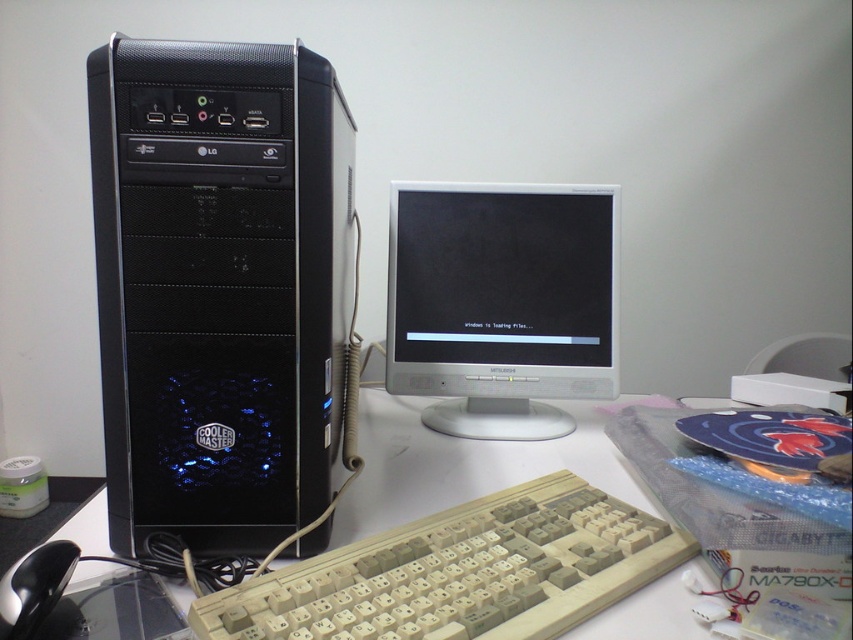
Is white plastic keyboard at center to the left of beige plastic keyboard at lower center from the viewer's perspective?

No, white plastic keyboard at center is not to the left of beige plastic keyboard at lower center.

Is white plastic keyboard at center taller than beige plastic keyboard at lower center?

Correct, white plastic keyboard at center is much taller as beige plastic keyboard at lower center.

The height and width of the screenshot is (640, 853). Describe the element at coordinates (462, 572) in the screenshot. I see `white plastic keyboard at center` at that location.

Find the location of a particular element. Image resolution: width=853 pixels, height=640 pixels. white plastic keyboard at center is located at coordinates pos(462,572).

Who is more distant from viewer, (480, 438) or (462, 506)?

The point (480, 438) is behind.

Who is positioned more to the right, white glossy monitor at center or beige plastic keyboard at lower center?

white glossy monitor at center

At what (x,y) coordinates should I click in order to perform the action: click on white glossy monitor at center. Please return your answer as a coordinate pair (x, y). This screenshot has height=640, width=853. Looking at the image, I should click on (502, 304).

Locate an element on the screen. white glossy monitor at center is located at coordinates (502, 304).

In the scene shown: Does white glossy monitor at center appear under black plastic mouse at lower left?

No, white glossy monitor at center is not below black plastic mouse at lower left.

Does white glossy monitor at center have a lesser width compared to black plastic mouse at lower left?

Incorrect, white glossy monitor at center's width is not less than black plastic mouse at lower left's.

Between point (611, 193) and point (18, 609), which one is positioned in front?

Point (18, 609) is more forward.

Locate an element on the screen. The image size is (853, 640). white glossy monitor at center is located at coordinates (502, 304).